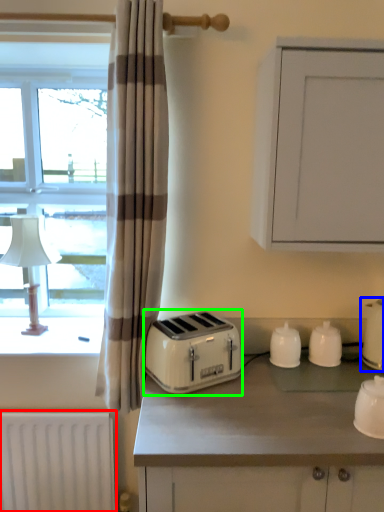
Question: Which object is positioned closest to radiator (highlighted by a red box)? Select from kitchen appliance (highlighted by a blue box) and toaster (highlighted by a green box).

Choices:
 (A) kitchen appliance
 (B) toaster

Answer: (B)